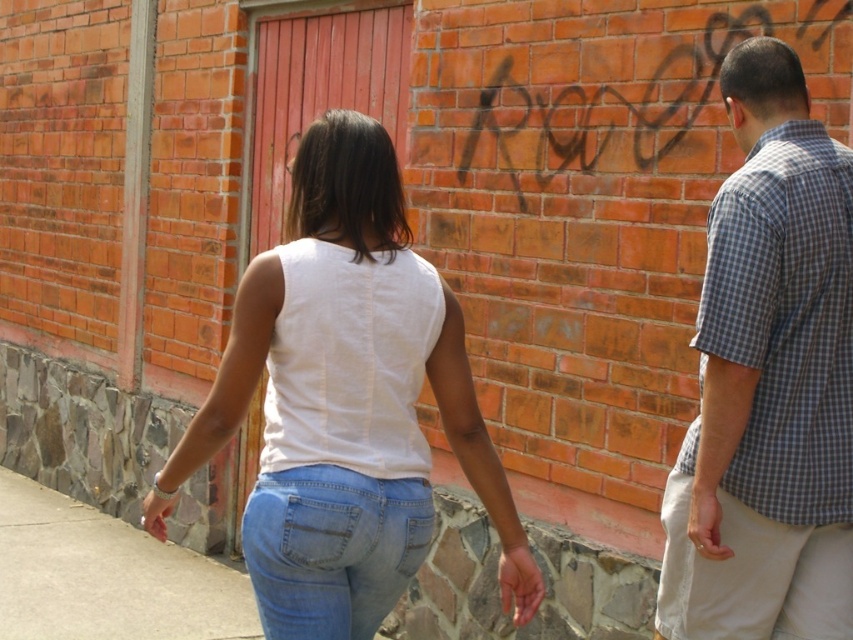
You are standing in front of the brick wall and want to reach the point marked at coordinates [793,470]. The two people are walking towards the wall. If the woman is currently 1.5 meters away from you and the man is 2 meters away, can both of them reach the point before you?

The point marked at coordinates [793,470] is 2.39 meters from the camera. The woman is 1.5 meters away from you, so she is closer and can reach the point before you. The man is 2 meters away, which is still less than 2.39 meters, so he can also reach the point before you. Both can reach the point before you.

In the scene shown: You are a photographer trying to capture both the checkered fabric shirt at right and the gray concrete pavement at lower left in the same frame. Which object will appear larger in your photo?

The gray concrete pavement at lower left will appear larger in the photo since the checkered fabric shirt at right has a smaller size compared to it.

You are standing at the camera position and want to hand a white cotton tank top at center to the person on the left. Can you reach them without moving? Please explain your reasoning.

The white cotton tank top at center and camera are 7.04 feet apart from each other. Since the distance between the camera and the tank top is over 7 feet, you would need to move closer to reach the person on the left to hand them the tank top.